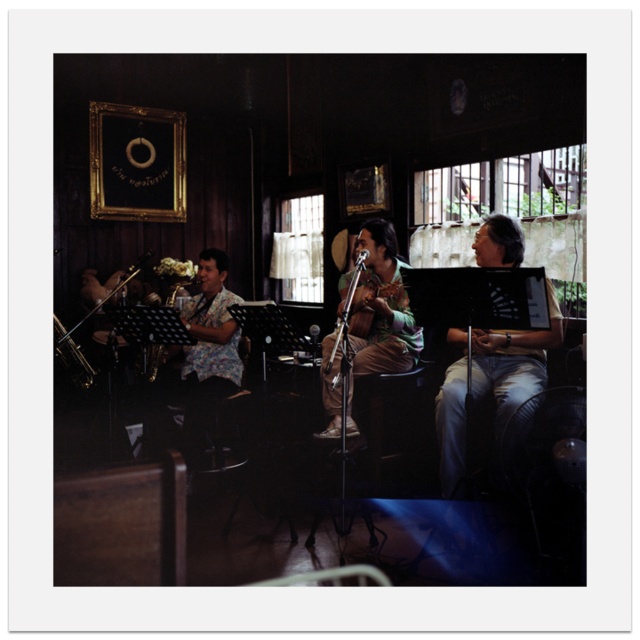
Question: Estimate the real-world distances between objects in this image. Which object is farther from the shiny brass saxophone at left?

Choices:
 (A) floral shirt at center
 (B) floral fabric guitar at center

Answer: (B)

Question: Is floral fabric guitar at center above shiny brass saxophone at left?

Choices:
 (A) yes
 (B) no

Answer: (A)

Question: Does floral fabric guitar at center appear on the right side of shiny brass saxophone at left?

Choices:
 (A) no
 (B) yes

Answer: (B)

Question: Can you confirm if floral shirt at center is bigger than shiny brass saxophone at left?

Choices:
 (A) no
 (B) yes

Answer: (B)

Question: Which point is closer to the camera?

Choices:
 (A) (154, 371)
 (B) (198, 369)
 (C) (77, 372)
 (D) (378, 246)

Answer: (D)

Question: Which point is farther to the camera?

Choices:
 (A) satin saxophone at center
 (B) floral fabric guitar at center
 (C) shiny brass saxophone at left

Answer: (A)